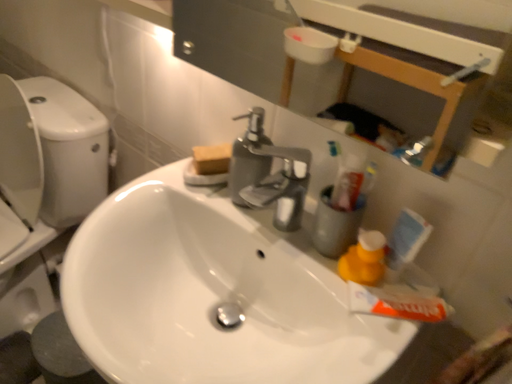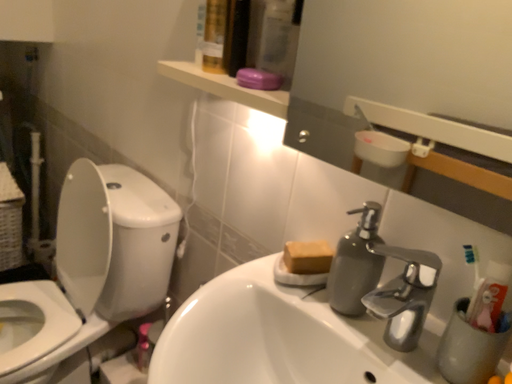
Question: How did the camera likely rotate when shooting the video?

Choices:
 (A) rotated upward
 (B) rotated downward

Answer: (A)